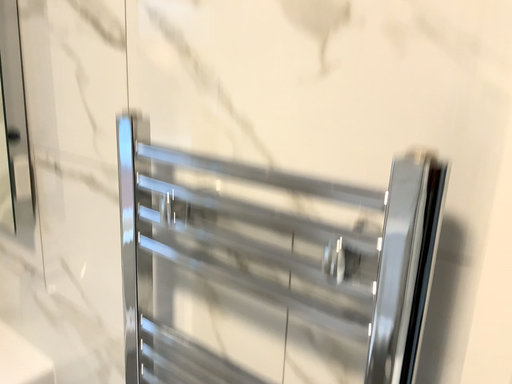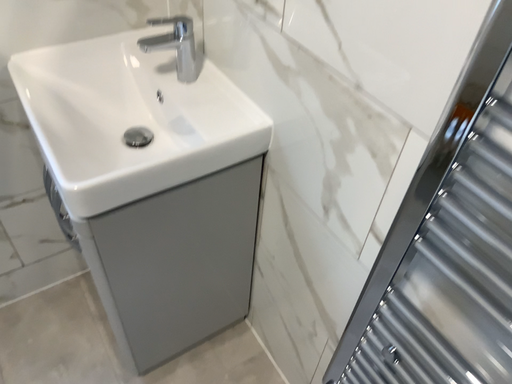
Question: Which way did the camera rotate in the video?

Choices:
 (A) rotated right
 (B) rotated left

Answer: (B)